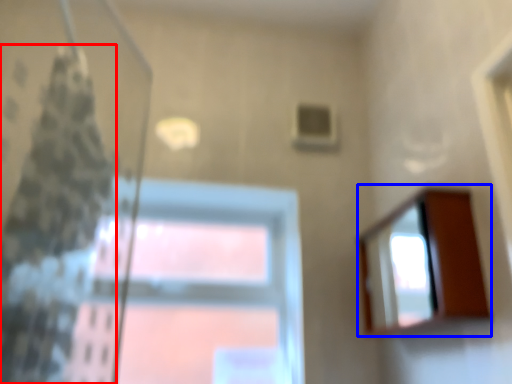
Question: Which object is closer to the camera taking this photo, shower curtain (highlighted by a red box) or mirror (highlighted by a blue box)?

Choices:
 (A) shower curtain
 (B) mirror

Answer: (A)